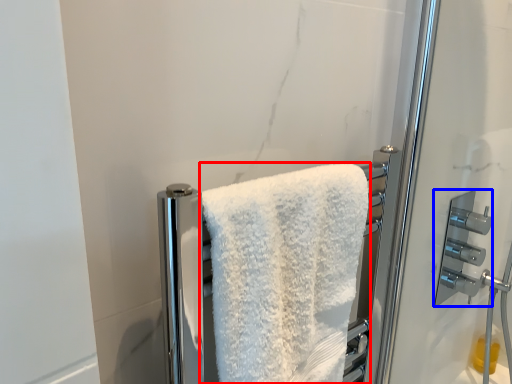
Question: Which of the following is the closest to the observer, towel (highlighted by a red box) or door handle (highlighted by a blue box)?

Choices:
 (A) towel
 (B) door handle

Answer: (A)